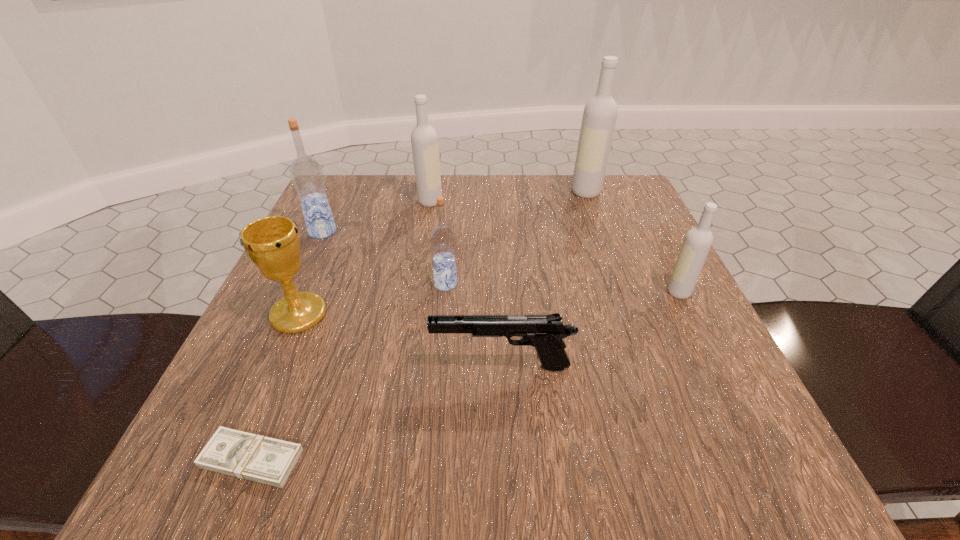
At what (x,y) coordinates should I click in order to perform the action: click on object present at the near left corner. Please return your answer as a coordinate pair (x, y). This screenshot has height=540, width=960. Looking at the image, I should click on (266, 460).

Locate an element on the screen. object that is at the far right corner is located at coordinates (600, 113).

In the image, there is a desktop. What are the coordinates of `vacant space at the far edge` in the screenshot? It's located at (415, 202).

You are a GUI agent. You are given a task and a screenshot of the screen. Output one action in this format:
    pyautogui.click(x=<x>, y=<y>)
    Task: Click on the vacant space at the near edge
    
    Given the screenshot: What is the action you would take?
    pyautogui.click(x=606, y=474)

This screenshot has width=960, height=540. Identify the location of vacant area at the left edge of the desktop. (268, 369).

I want to click on free point at the right edge, so click(670, 294).

Where is `vacant space at the far left corner of the desktop`? The height and width of the screenshot is (540, 960). vacant space at the far left corner of the desktop is located at coordinates [331, 186].

Identify the location of free region at the far right corner of the desktop. Image resolution: width=960 pixels, height=540 pixels. (623, 195).

In order to click on free area in between the right blue vodka and the chalice in this screenshot , I will do `click(372, 299)`.

The height and width of the screenshot is (540, 960). I want to click on free space between the second vodka from right to left and the fourth vodka from right to left, so click(508, 197).